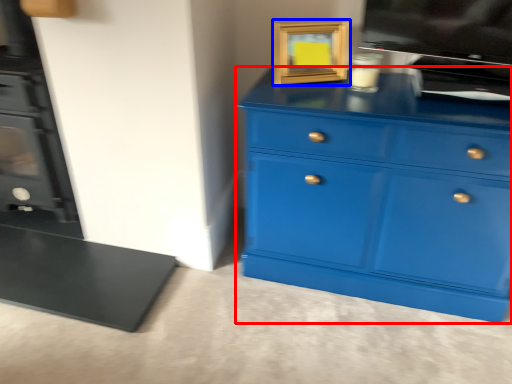
Question: Among these objects, which one is farthest to the camera, chest of drawers (highlighted by a red box) or picture frame (highlighted by a blue box)?

Choices:
 (A) chest of drawers
 (B) picture frame

Answer: (B)